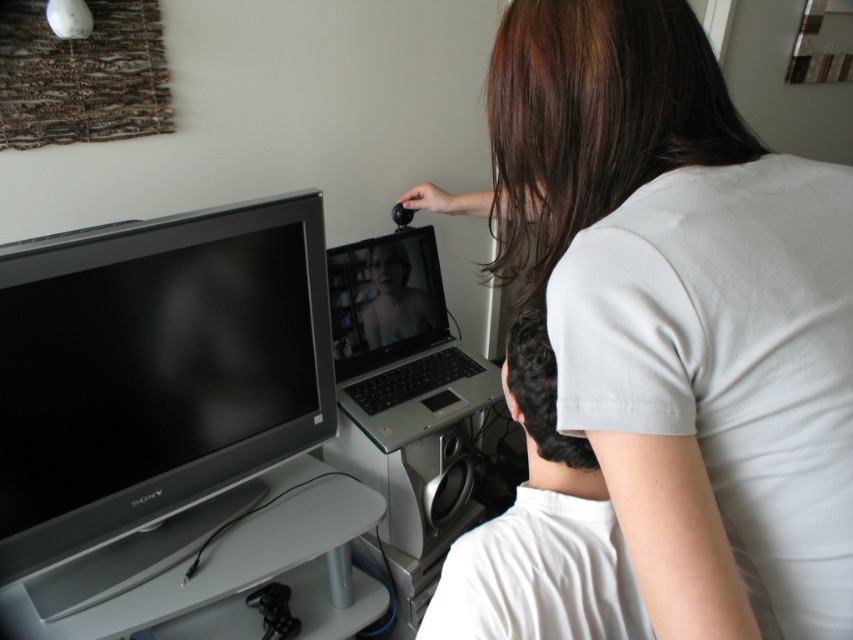
You are a delivery person who just arrived at the address. The recipient is currently in the room shown in the image and wants you to place a package on the silver metallic flat screen tv at left. However, there is an object already occupying the space at point (152,387). What is the object blocking the way?

The object blocking the way is the silver metallic flat screen tv at left located at point (152,387).